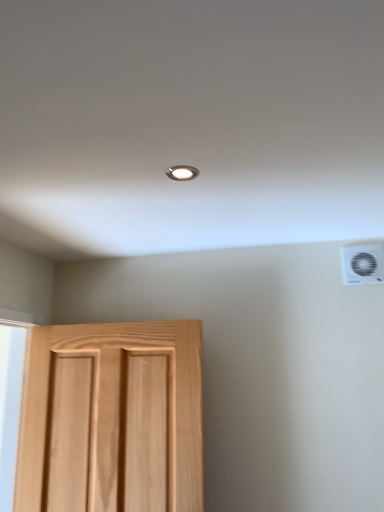
Locate an element on the screen. This screenshot has width=384, height=512. white plastic air conditioning unit at upper right is located at coordinates (362, 264).

This screenshot has height=512, width=384. What do you see at coordinates (362, 264) in the screenshot? I see `white plastic air conditioning unit at upper right` at bounding box center [362, 264].

Image resolution: width=384 pixels, height=512 pixels. Identify the location of natural wood door at lower left. (112, 418).

What do you see at coordinates (112, 418) in the screenshot? The width and height of the screenshot is (384, 512). I see `natural wood door at lower left` at bounding box center [112, 418].

Where is `white plastic air conditioning unit at upper right`? The height and width of the screenshot is (512, 384). white plastic air conditioning unit at upper right is located at coordinates (362, 264).

Which object is positioned more to the right, white plastic air conditioning unit at upper right or natural wood door at lower left?

white plastic air conditioning unit at upper right is more to the right.

Does white plastic air conditioning unit at upper right come in front of natural wood door at lower left?

No.

Is point (380, 257) less distant than point (154, 426)?

No, it is behind (154, 426).

From the image's perspective, is white plastic air conditioning unit at upper right located beneath natural wood door at lower left?

Actually, white plastic air conditioning unit at upper right appears above natural wood door at lower left in the image.

From a real-world perspective, is white plastic air conditioning unit at upper right physically located above or below natural wood door at lower left?

white plastic air conditioning unit at upper right is situated higher than natural wood door at lower left in the real world.

Looking at their sizes, would you say white plastic air conditioning unit at upper right is wider or thinner than natural wood door at lower left?

Considering their sizes, white plastic air conditioning unit at upper right looks slimmer than natural wood door at lower left.

Who is shorter, white plastic air conditioning unit at upper right or natural wood door at lower left?

With less height is white plastic air conditioning unit at upper right.

Who is smaller, white plastic air conditioning unit at upper right or natural wood door at lower left?

With smaller size is white plastic air conditioning unit at upper right.

Is natural wood door at lower left surrounded by white plastic air conditioning unit at upper right?

No, natural wood door at lower left is not surrounded by white plastic air conditioning unit at upper right.

Is white plastic air conditioning unit at upper right in contact with natural wood door at lower left?

No, white plastic air conditioning unit at upper right is not touching natural wood door at lower left.

Is white plastic air conditioning unit at upper right facing away from natural wood door at lower left?

white plastic air conditioning unit at upper right is not turned away from natural wood door at lower left.

Identify the location of air conditioning above the natural wood door at lower left (from the image's perspective). The width and height of the screenshot is (384, 512). (362, 264).

Is natural wood door at lower left to the left of white plastic air conditioning unit at upper right from the viewer's perspective?

Yes, natural wood door at lower left is to the left of white plastic air conditioning unit at upper right.

Is the depth of natural wood door at lower left less than that of white plastic air conditioning unit at upper right?

Yes, the depth of natural wood door at lower left is less than that of white plastic air conditioning unit at upper right.

Is point (40, 469) farther from viewer compared to point (382, 264)?

Yes, it is.

From the image's perspective, is natural wood door at lower left positioned above or below white plastic air conditioning unit at upper right?

natural wood door at lower left is below white plastic air conditioning unit at upper right.

From a real-world perspective, is natural wood door at lower left physically located above or below white plastic air conditioning unit at upper right?

In terms of real-world spatial position, natural wood door at lower left is below white plastic air conditioning unit at upper right.

Does natural wood door at lower left have a greater width compared to white plastic air conditioning unit at upper right?

Indeed, natural wood door at lower left has a greater width compared to white plastic air conditioning unit at upper right.

Who is taller, natural wood door at lower left or white plastic air conditioning unit at upper right?

Standing taller between the two is natural wood door at lower left.

Based on the photo, considering the relative sizes of natural wood door at lower left and white plastic air conditioning unit at upper right in the image provided, is natural wood door at lower left bigger than white plastic air conditioning unit at upper right?

→ Correct, natural wood door at lower left is larger in size than white plastic air conditioning unit at upper right.

Is white plastic air conditioning unit at upper right inside natural wood door at lower left?

No, white plastic air conditioning unit at upper right is located outside of natural wood door at lower left.

Is natural wood door at lower left not near white plastic air conditioning unit at upper right?

Yes, natural wood door at lower left and white plastic air conditioning unit at upper right are quite far apart.

Is white plastic air conditioning unit at upper right at the back of natural wood door at lower left?

No, white plastic air conditioning unit at upper right is not at the back of natural wood door at lower left.

Find the location of `door below the white plastic air conditioning unit at upper right (from a real-world perspective)`. door below the white plastic air conditioning unit at upper right (from a real-world perspective) is located at coordinates (112, 418).

You are a GUI agent. You are given a task and a screenshot of the screen. Output one action in this format:
    pyautogui.click(x=<x>, y=<y>)
    Task: Click on the air conditioning on the right of the natural wood door at lower left
    
    Given the screenshot: What is the action you would take?
    pyautogui.click(x=362, y=264)

Where is `air conditioning behind the natural wood door at lower left`? air conditioning behind the natural wood door at lower left is located at coordinates (362, 264).